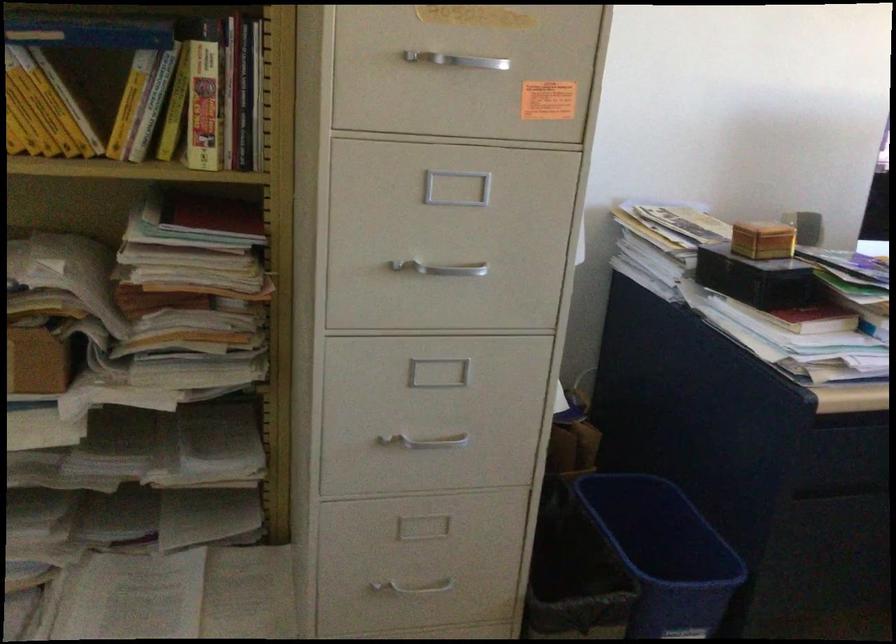
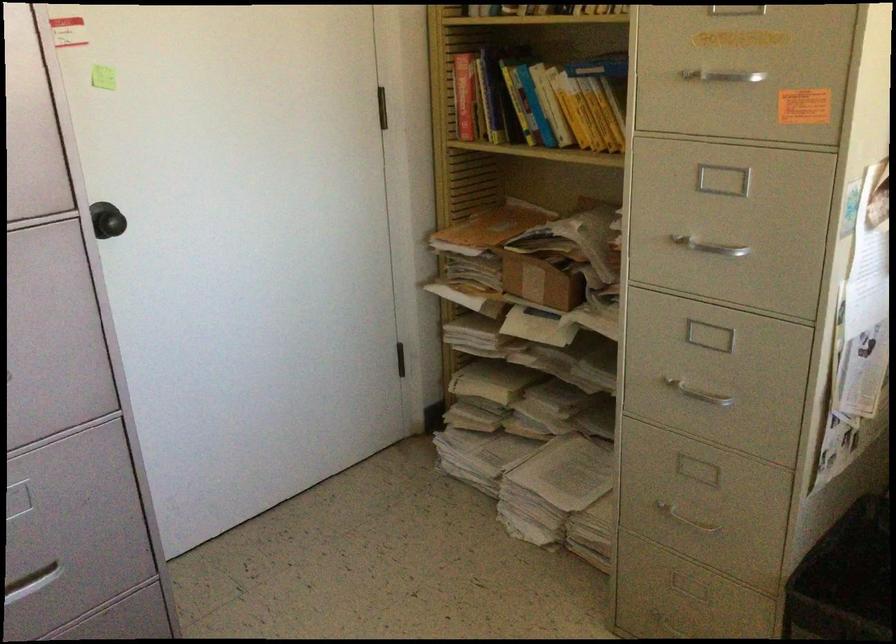
Find the pixel in the second image that matches pixel 461 67 in the first image.

(725, 82)